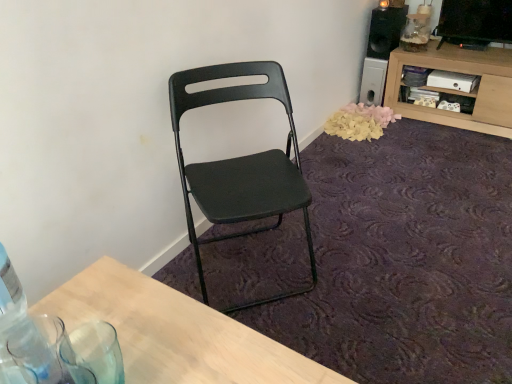
The height and width of the screenshot is (384, 512). Identify the location of free space in front of yellow paper petals at lower right. (381, 150).